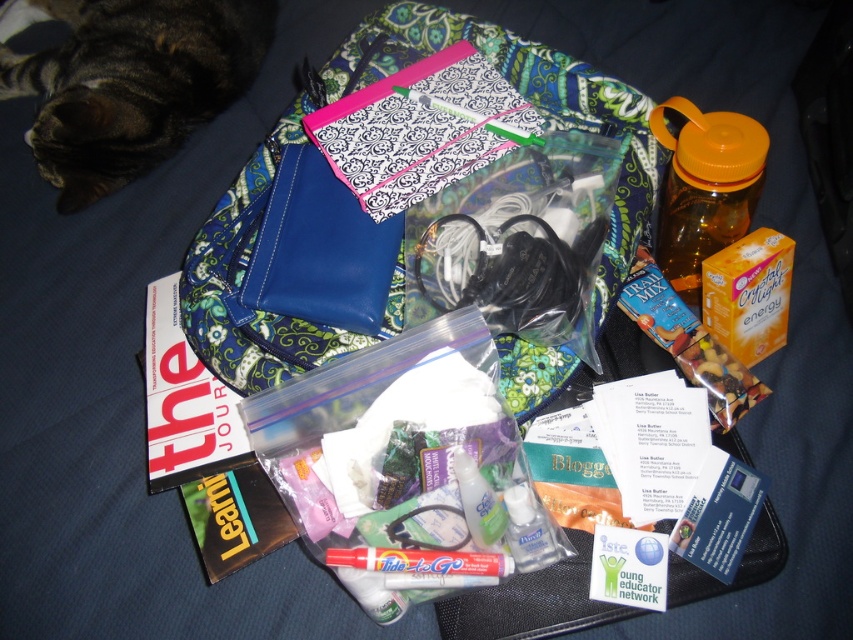
You are organizing items on a dark blue fabric surface. You have a matte blue pouch at center and a tabby fur cat at upper left. Which object is wider?

The matte blue pouch at center is wider than the tabby fur cat at upper left.

You are standing 1 meter away from the dark blue fabric surface. You want to pick up the matte blue pouch at center. Can you reach it without moving closer?

The matte blue pouch at center is 96.66 centimeters away from viewer. Since you are standing 1 meter away, which is 100 centimeters, you can reach it without moving closer as the distance is slightly less than your current position.

You are standing in front of the image and want to pick up an item from the surface. If you look at the two points labeled as point [660,234] and point [538,508], which one is closer to you?

Point [660,234] is further to the camera than point [538,508], so the point closer to you is point [538,508].